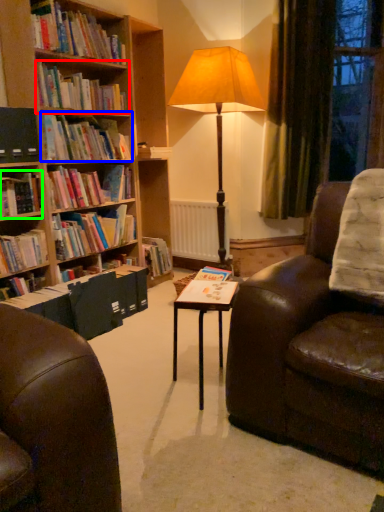
Question: Which object is the closest to the book (highlighted by a red box)? Choose among these: book (highlighted by a blue box) or book (highlighted by a green box).

Choices:
 (A) book
 (B) book

Answer: (A)